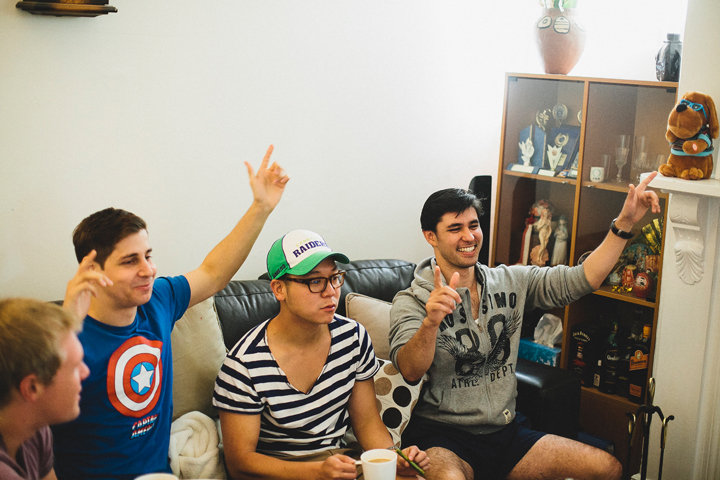
Where is `sofa`? This screenshot has width=720, height=480. sofa is located at coordinates (191, 357), (543, 394).